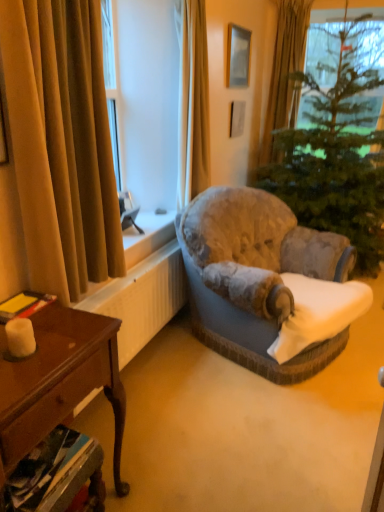
Find the location of a particular element. The image size is (384, 512). free space in front of velvet grey armchair at center is located at coordinates (255, 432).